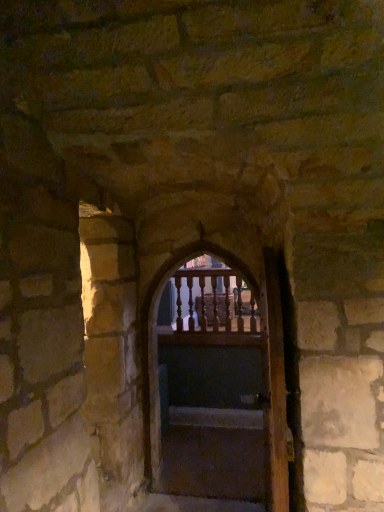
Question: Could you tell me if wooden door at center, marked as the 1th door in a front-to-back arrangement, is facing smooth concrete stairs at center?

Choices:
 (A) no
 (B) yes

Answer: (A)

Question: Is wooden door at center, marked as the 1th door in a front-to-back arrangement, oriented away from smooth concrete stairs at center?

Choices:
 (A) yes
 (B) no

Answer: (B)

Question: Can smooth concrete stairs at center be found inside wooden door at center, marked as the 1th door in a front-to-back arrangement?

Choices:
 (A) no
 (B) yes

Answer: (A)

Question: From a real-world perspective, is wooden door at center, marked as the 1th door in a front-to-back arrangement, located beneath smooth concrete stairs at center?

Choices:
 (A) no
 (B) yes

Answer: (A)

Question: Is wooden door at center, marked as the 1th door in a front-to-back arrangement, positioned before smooth concrete stairs at center?

Choices:
 (A) yes
 (B) no

Answer: (A)

Question: From the image's perspective, is wooden door at center, which is the second door from back to front, below smooth concrete stairs at center?

Choices:
 (A) no
 (B) yes

Answer: (A)

Question: Does wooden door at center, marked as the 1th door in a front-to-back arrangement, have a greater height compared to wooden at center, acting as the second door starting from the front?

Choices:
 (A) yes
 (B) no

Answer: (B)

Question: Can you see wooden door at center, which is the second door from back to front, touching wooden at center, acting as the second door starting from the front?

Choices:
 (A) no
 (B) yes

Answer: (A)

Question: Does wooden door at center, marked as the 1th door in a front-to-back arrangement, have a greater width compared to wooden at center, which is counted as the first door, starting from the back?

Choices:
 (A) yes
 (B) no

Answer: (B)

Question: Is wooden door at center, marked as the 1th door in a front-to-back arrangement, smaller than wooden at center, which is counted as the first door, starting from the back?

Choices:
 (A) yes
 (B) no

Answer: (A)

Question: Considering the relative sizes of wooden door at center, marked as the 1th door in a front-to-back arrangement, and wooden at center, acting as the second door starting from the front, in the image provided, is wooden door at center, marked as the 1th door in a front-to-back arrangement, bigger than wooden at center, acting as the second door starting from the front,?

Choices:
 (A) yes
 (B) no

Answer: (B)

Question: Is wooden door at center, marked as the 1th door in a front-to-back arrangement, shorter than wooden at center, acting as the second door starting from the front?

Choices:
 (A) yes
 (B) no

Answer: (A)

Question: Is smooth concrete stairs at center facing away from wooden door at center, marked as the 1th door in a front-to-back arrangement?

Choices:
 (A) no
 (B) yes

Answer: (A)